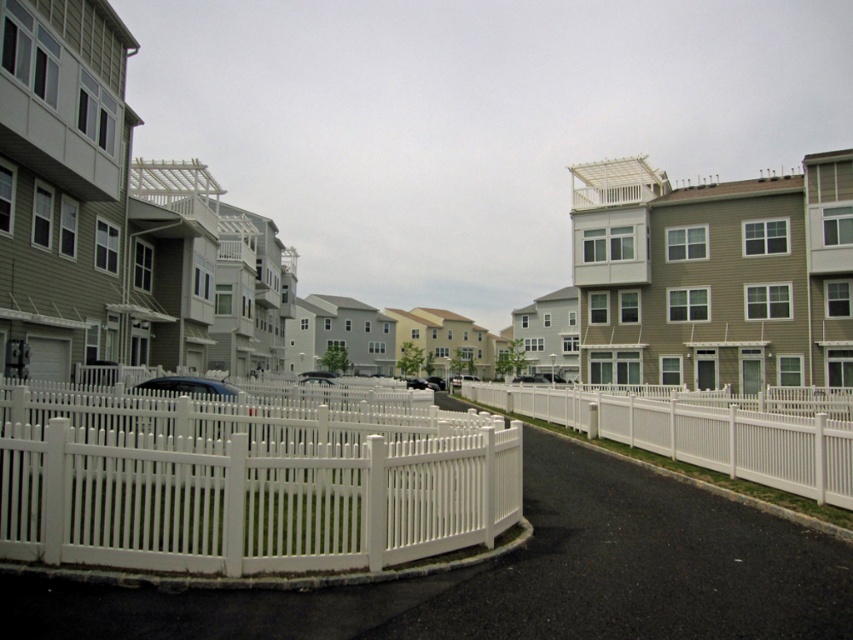
Based on the photo, which is more to the right, white picket fence at center or white vinyl fence at center?

Positioned to the right is white vinyl fence at center.

Is point (131, 486) positioned after point (799, 422)?

No, (131, 486) is closer to viewer.

Locate an element on the screen. white picket fence at center is located at coordinates (245, 481).